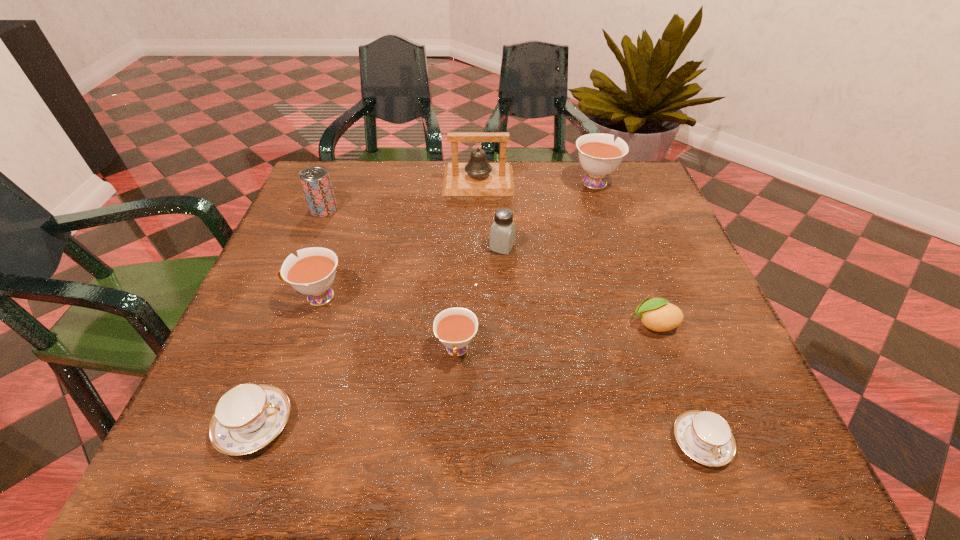
The image size is (960, 540). What are the coordinates of `the tallest object` in the screenshot? It's located at click(477, 177).

You are a GUI agent. You are given a task and a screenshot of the screen. Output one action in this format:
    pyautogui.click(x=<x>, y=<y>)
    Task: Click on the farthest white teacup
    This screenshot has width=960, height=540.
    Given the screenshot: What is the action you would take?
    pyautogui.click(x=599, y=155)

You are a GUI agent. You are given a task and a screenshot of the screen. Output one action in this format:
    pyautogui.click(x=<x>, y=<y>)
    Task: Click on the tallest teacup
    The width and height of the screenshot is (960, 540).
    Given the screenshot: What is the action you would take?
    pyautogui.click(x=599, y=155)

I want to click on red beer can, so click(x=315, y=180).

This screenshot has width=960, height=540. In order to click on beer can in this screenshot , I will do `click(315, 180)`.

Identify the location of the fourth farthest object. (503, 230).

Where is `the second smallest white teacup`? This screenshot has width=960, height=540. the second smallest white teacup is located at coordinates (312, 273).

Find the location of `the second farthest white teacup`. the second farthest white teacup is located at coordinates (312, 273).

The width and height of the screenshot is (960, 540). I want to click on the third teacup from left to right, so click(x=455, y=327).

Where is `the smallest white teacup`? This screenshot has width=960, height=540. the smallest white teacup is located at coordinates (455, 327).